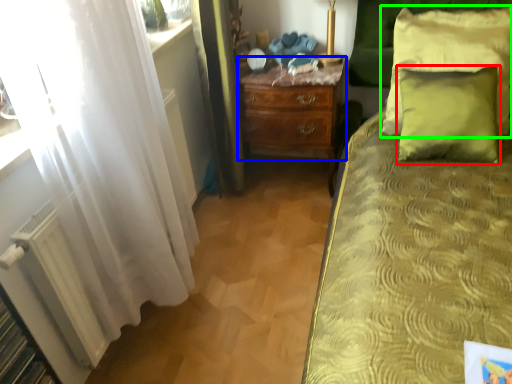
Question: Which is farther away from pillow (highlighted by a red box)? nightstand (highlighted by a blue box) or pillow (highlighted by a green box)?

Choices:
 (A) nightstand
 (B) pillow

Answer: (A)